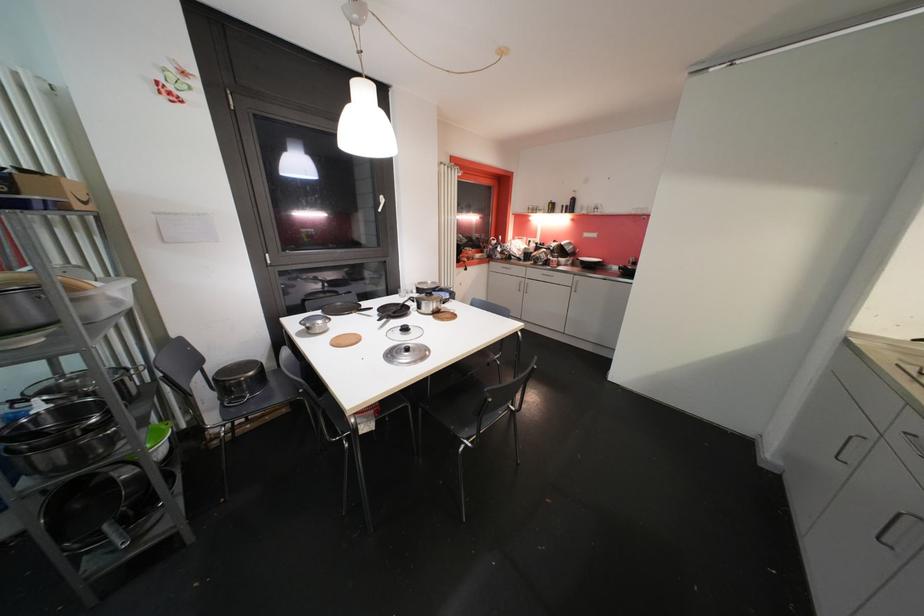
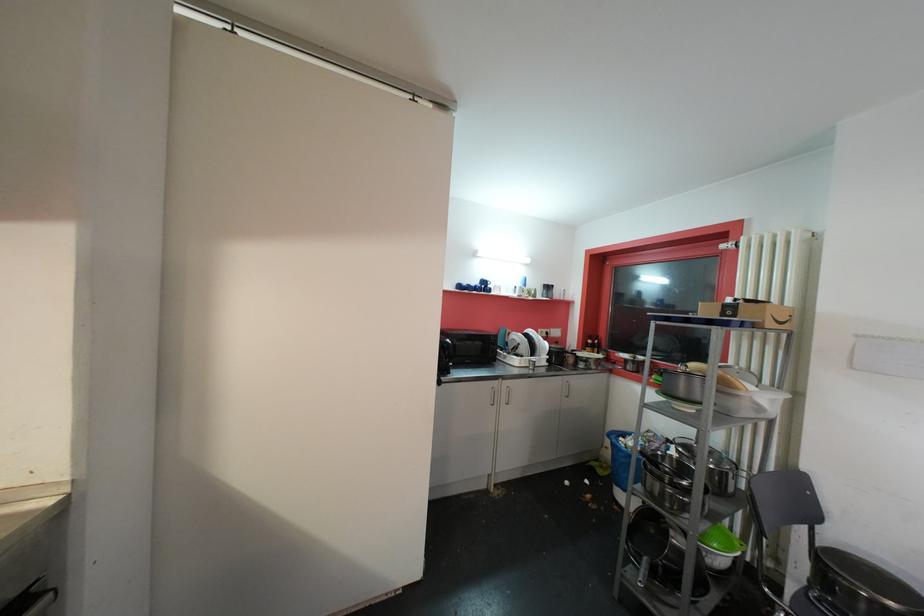
In the second image, find the point that corresponds to pixel 149 432 in the first image.

(713, 525)